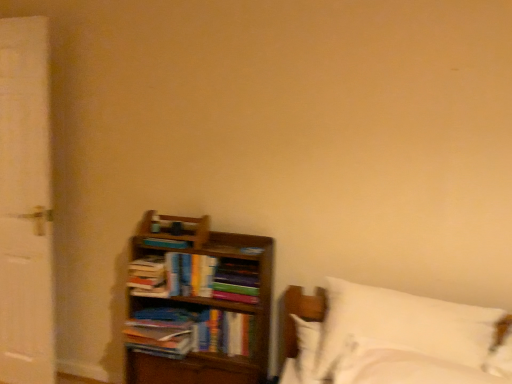
Question: From a real-world perspective, is hardcover book at center, the fourth book positioned from the top, physically below hardcover books at center, the 3th book in the top-to-bottom sequence?

Choices:
 (A) yes
 (B) no

Answer: (A)

Question: Can you confirm if hardcover book at center, the fourth book positioned from the top, is taller than hardcover books at center, the 3th book in the top-to-bottom sequence?

Choices:
 (A) no
 (B) yes

Answer: (B)

Question: Can you confirm if hardcover book at center, the fourth book positioned from the top, is bigger than hardcover books at center, the second book when ordered from bottom to top?

Choices:
 (A) yes
 (B) no

Answer: (A)

Question: Can you confirm if hardcover book at center, the fourth book positioned from the top, is positioned to the right of hardcover books at center, the 3th book in the top-to-bottom sequence?

Choices:
 (A) yes
 (B) no

Answer: (B)

Question: Does hardcover book at center, the fourth book positioned from the top, have a lesser height compared to hardcover books at center, the 3th book in the top-to-bottom sequence?

Choices:
 (A) yes
 (B) no

Answer: (B)

Question: Is point (457, 365) positioned closer to the camera than point (237, 324)?

Choices:
 (A) farther
 (B) closer

Answer: (B)

Question: From the image's perspective, is white soft bed at lower right positioned above or below hardcover book at center, which ranks as the first book in bottom-to-top order?

Choices:
 (A) below
 (B) above

Answer: (B)

Question: In terms of size, does white soft bed at lower right appear bigger or smaller than hardcover book at center, the fourth book positioned from the top?

Choices:
 (A) big
 (B) small

Answer: (A)

Question: From a real-world perspective, relative to hardcover book at center, the fourth book positioned from the top, is white soft bed at lower right vertically above or below?

Choices:
 (A) above
 (B) below

Answer: (A)

Question: Relative to hardcover book at center, which ranks as the first book in bottom-to-top order, is hardcover book at left, positioned as the fourth book in bottom-to-top order, in front or behind?

Choices:
 (A) behind
 (B) front

Answer: (A)

Question: Which is correct: hardcover book at left, which appears as the 1th book when viewed from the top, is inside hardcover book at center, the fourth book positioned from the top, or outside of it?

Choices:
 (A) outside
 (B) inside

Answer: (A)

Question: Based on their positions, is hardcover book at left, positioned as the fourth book in bottom-to-top order, located to the left or right of hardcover book at center, which ranks as the first book in bottom-to-top order?

Choices:
 (A) left
 (B) right

Answer: (A)

Question: Is hardcover book at left, which appears as the 1th book when viewed from the top, wider or thinner than hardcover book at center, the fourth book positioned from the top?

Choices:
 (A) thin
 (B) wide

Answer: (A)

Question: Is hardcover books at center, the second book when ordered from bottom to top, spatially inside wooden bookcase at lower left, or outside of it?

Choices:
 (A) inside
 (B) outside

Answer: (A)

Question: From a real-world perspective, is hardcover books at center, the 3th book in the top-to-bottom sequence, physically located above or below wooden bookcase at lower left?

Choices:
 (A) below
 (B) above

Answer: (B)